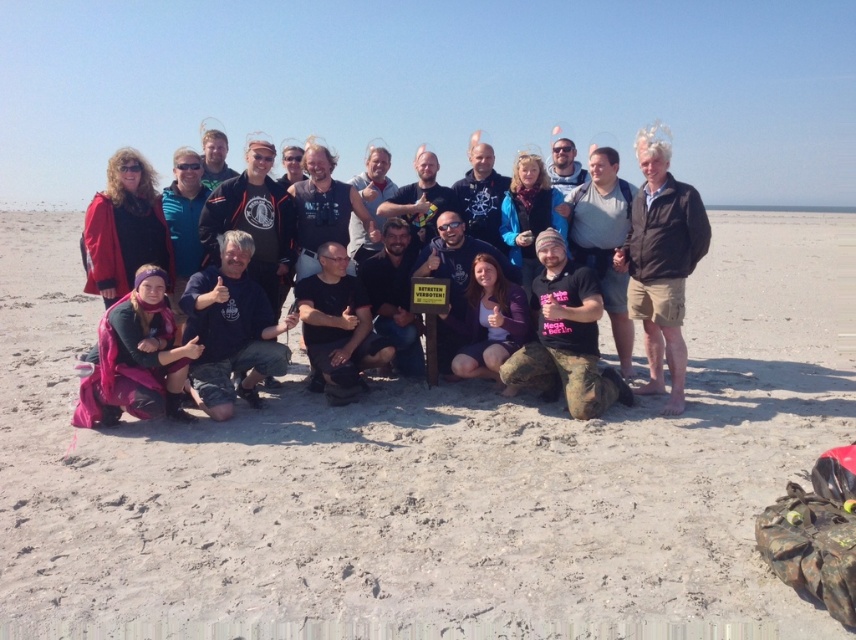
Does pink fabric at center appear on the left side of brown leather jacket at right?

Yes, pink fabric at center is to the left of brown leather jacket at right.

Can you confirm if pink fabric at center is smaller than brown leather jacket at right?

Incorrect, pink fabric at center is not smaller in size than brown leather jacket at right.

You are a GUI agent. You are given a task and a screenshot of the screen. Output one action in this format:
    pyautogui.click(x=<x>, y=<y>)
    Task: Click on the pink fabric at center
    The image size is (856, 640).
    Given the screenshot: What is the action you would take?
    pyautogui.click(x=642, y=252)

Which is below, smooth sand at center or brown leather jacket at right?

Positioned lower is smooth sand at center.

Does smooth sand at center lie behind brown leather jacket at right?

No, smooth sand at center is closer to the viewer.

Who is more distant from viewer, (54,456) or (617,260)?

The point (617,260) is more distant.

Where is `smooth sand at center`? smooth sand at center is located at coordinates (429, 467).

At what (x,y) coordinates should I click in order to perform the action: click on smooth sand at center. Please return your answer as a coordinate pair (x, y). This screenshot has height=640, width=856. Looking at the image, I should click on (429, 467).

Is smooth sand at center further to the viewer compared to pink fabric at center?

No.

I want to click on smooth sand at center, so click(429, 467).

Where is `smooth sand at center`? The image size is (856, 640). smooth sand at center is located at coordinates (429, 467).